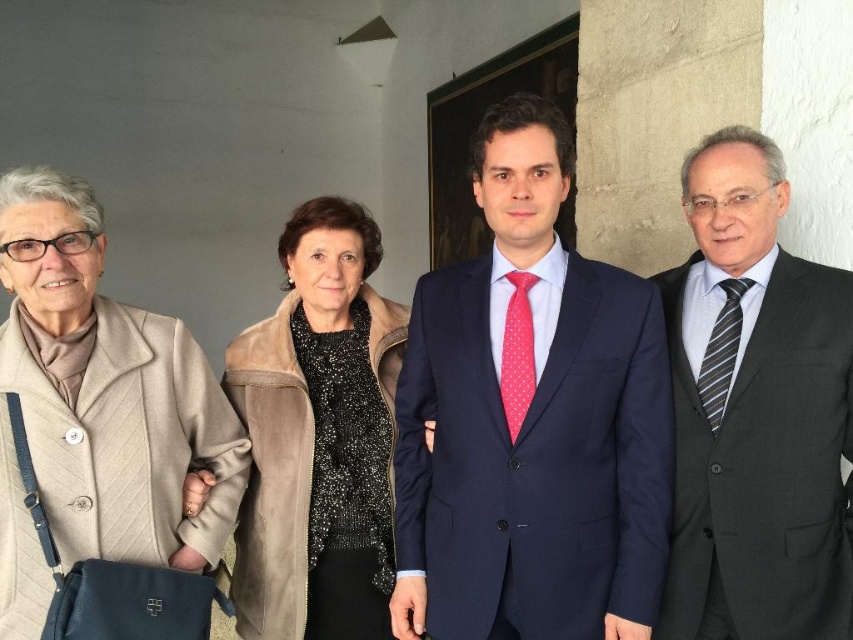
Question: Which object is the farthest from the navy blue suit at center?

Choices:
 (A) suede jacket at center
 (B) pink dotted fabric tie at center

Answer: (A)

Question: Which is nearer to the beige quilted coat at left?

Choices:
 (A) striped silk tie at right
 (B) pink dotted fabric tie at center
 (C) suede jacket at center
 (D) navy blue suit at center

Answer: (C)

Question: Which object is the farthest from the striped silk tie at right?

Choices:
 (A) suede jacket at center
 (B) dark gray suit at right
 (C) navy blue suit at center
 (D) pink dotted fabric tie at center

Answer: (A)

Question: Does suede jacket at center appear under pink dotted fabric tie at center?

Choices:
 (A) no
 (B) yes

Answer: (B)

Question: Does beige quilted coat at left appear on the right side of pink dotted fabric tie at center?

Choices:
 (A) no
 (B) yes

Answer: (A)

Question: Does navy blue suit at center appear on the right side of pink dotted fabric tie at center?

Choices:
 (A) yes
 (B) no

Answer: (B)